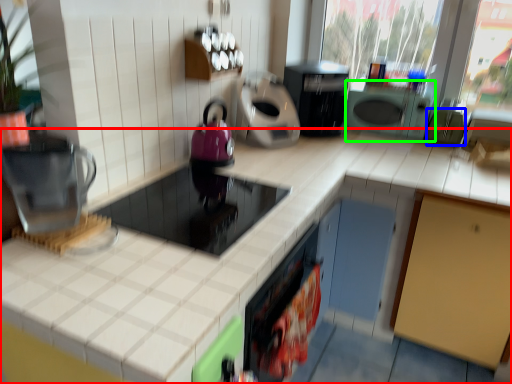
Question: Considering the real-world distances, which object is closest to countertop (highlighted by a red box)? appliance (highlighted by a blue box) or appliance (highlighted by a green box).

Choices:
 (A) appliance
 (B) appliance

Answer: (B)